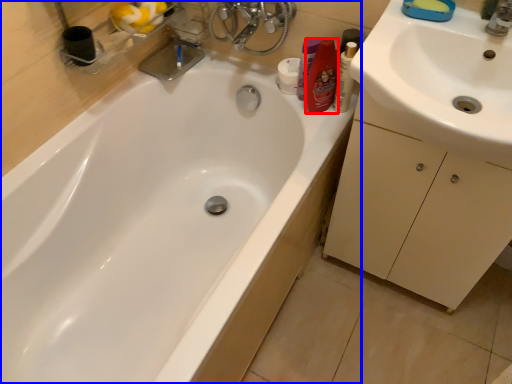
Question: Which object is closer to the camera taking this photo, toiletry (highlighted by a red box) or bathtub (highlighted by a blue box)?

Choices:
 (A) toiletry
 (B) bathtub

Answer: (B)